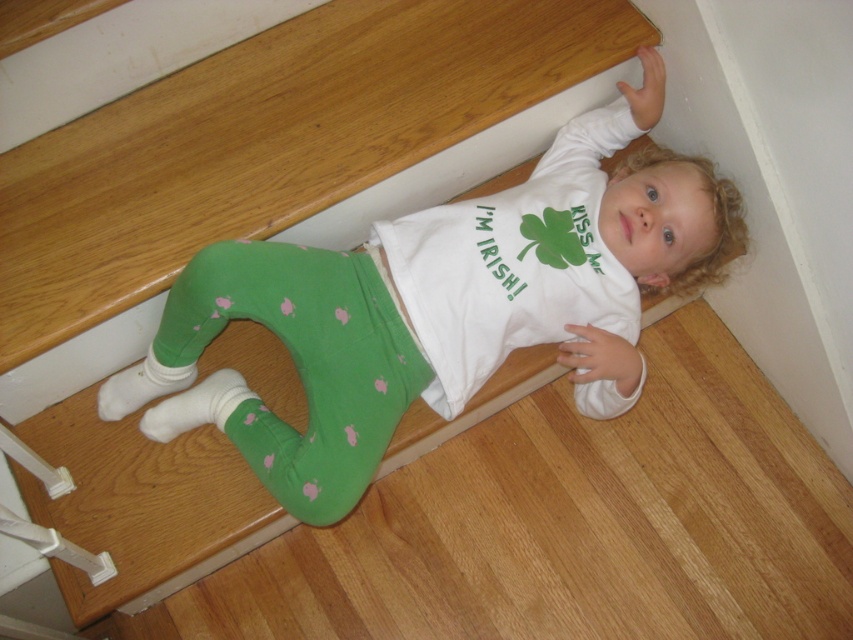
Can you confirm if green cotton leggings at lower center is shorter than green polka dot leggings at lower center?

No, green cotton leggings at lower center is not shorter than green polka dot leggings at lower center.

The width and height of the screenshot is (853, 640). What do you see at coordinates (440, 305) in the screenshot? I see `green cotton leggings at lower center` at bounding box center [440, 305].

I want to click on green cotton leggings at lower center, so coord(440,305).